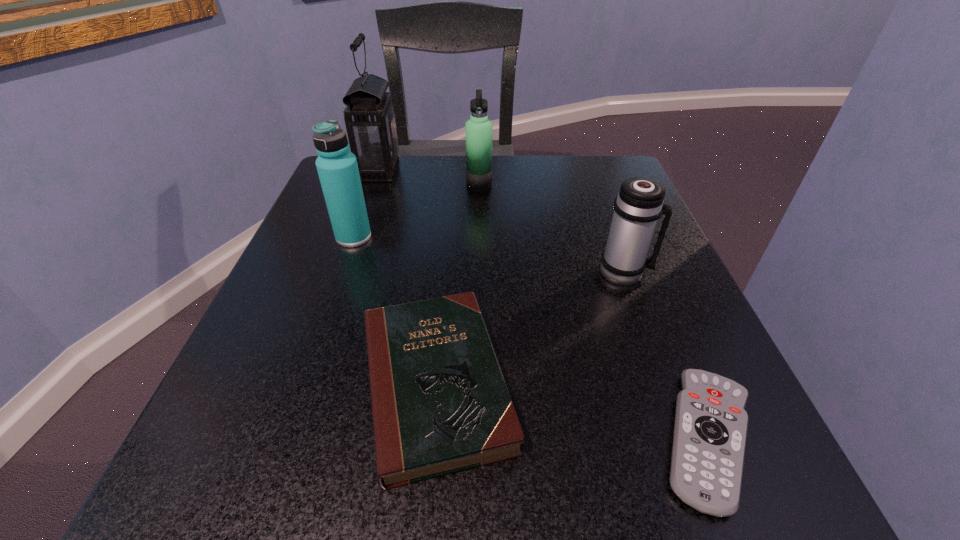
Locate an element on the screen. The image size is (960, 540). remote control positioned at the right edge is located at coordinates (710, 430).

The height and width of the screenshot is (540, 960). I want to click on object at the far left corner, so click(370, 122).

Identify the location of object located in the near right corner section of the desktop. Image resolution: width=960 pixels, height=540 pixels. (710, 430).

In the image, there is a desktop. Where is `vacant space at the far edge`? The image size is (960, 540). vacant space at the far edge is located at coordinates (545, 207).

In the image, there is a desktop. Where is `vacant space at the near edge`? The width and height of the screenshot is (960, 540). vacant space at the near edge is located at coordinates coord(601,451).

Identify the location of vacant space at the left edge of the desktop. Image resolution: width=960 pixels, height=540 pixels. (345, 271).

Identify the location of free space at the right edge of the desktop. Image resolution: width=960 pixels, height=540 pixels. (663, 287).

Identify the location of free location at the far left corner. The height and width of the screenshot is (540, 960). (381, 207).

In order to click on vacant area at the far right corner in this screenshot , I will do point(601,177).

Locate an element on the screen. free spot at the near right corner of the desktop is located at coordinates (674, 520).